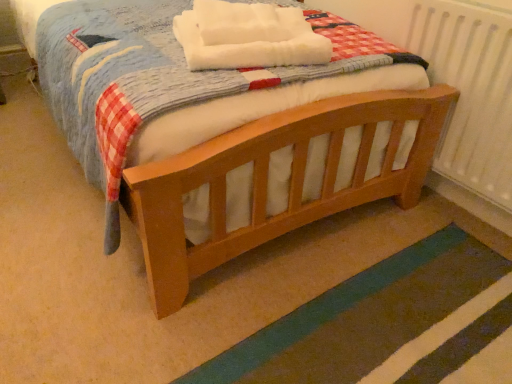
You are a GUI agent. You are given a task and a screenshot of the screen. Output one action in this format:
    pyautogui.click(x=<x>, y=<y>)
    Task: Click on the vacant space in white textured radiator at right (from a real-world perspective)
    The width and height of the screenshot is (512, 384).
    Given the screenshot: What is the action you would take?
    pyautogui.click(x=454, y=211)